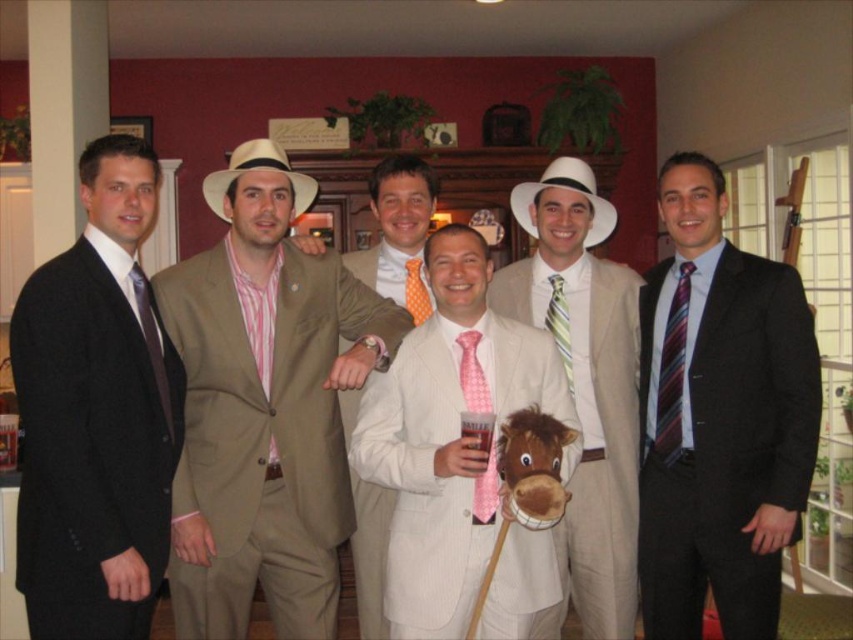
Question: Is striped tie at right below striped silk tie at right?

Choices:
 (A) yes
 (B) no

Answer: (A)

Question: Which of the following is the farthest from the observer?

Choices:
 (A) striped silk tie at right
 (B) matte black suit at left
 (C) striped tie at right
 (D) orange polka dot tie at center

Answer: (D)

Question: Does striped tie at right have a larger size compared to white straw hat at center?

Choices:
 (A) no
 (B) yes

Answer: (B)

Question: Is matte black suit at left positioned behind pink textured suit at center?

Choices:
 (A) no
 (B) yes

Answer: (A)

Question: Among these objects, which one is farthest from the camera?

Choices:
 (A) matte black suit at left
 (B) pinstripe suit at center
 (C) white felt cowboy hat at center

Answer: (C)

Question: Estimate the real-world distances between objects in this image. Which object is farther from the striped tie at right?

Choices:
 (A) pinstripe suit at center
 (B) white felt cowboy hat at center
 (C) brown plush horse at center

Answer: (C)